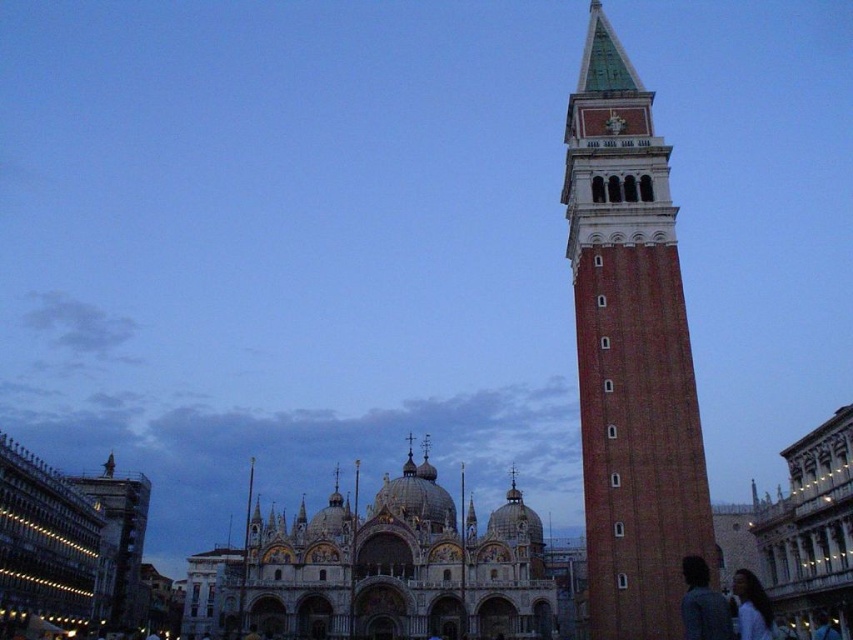
Is brick tower at right shorter than white marble cathedral at center?

In fact, brick tower at right may be taller than white marble cathedral at center.

Locate an element on the screen. brick tower at right is located at coordinates (630, 353).

Which is in front, point (672, 371) or point (383, 620)?

Point (672, 371) is more forward.

At what (x,y) coordinates should I click in order to perform the action: click on brick tower at right. Please return your answer as a coordinate pair (x, y). Image resolution: width=853 pixels, height=640 pixels. Looking at the image, I should click on (630, 353).

Can you confirm if white marble cathedral at center is shorter than white matte shirt at lower right?

No.

Between point (525, 516) and point (738, 614), which one is positioned behind?

The point (525, 516) is more distant.

Find the location of a particular element. The height and width of the screenshot is (640, 853). white marble cathedral at center is located at coordinates (379, 570).

Image resolution: width=853 pixels, height=640 pixels. I want to click on white marble cathedral at center, so click(x=379, y=570).

Does dark hair at center appear over white matte shirt at lower right?

Yes, dark hair at center is above white matte shirt at lower right.

Image resolution: width=853 pixels, height=640 pixels. Describe the element at coordinates (701, 604) in the screenshot. I see `dark hair at center` at that location.

Between point (694, 595) and point (755, 609), which one is positioned in front?

Point (694, 595) is in front.

The width and height of the screenshot is (853, 640). In order to click on dark hair at center in this screenshot , I will do `click(701, 604)`.